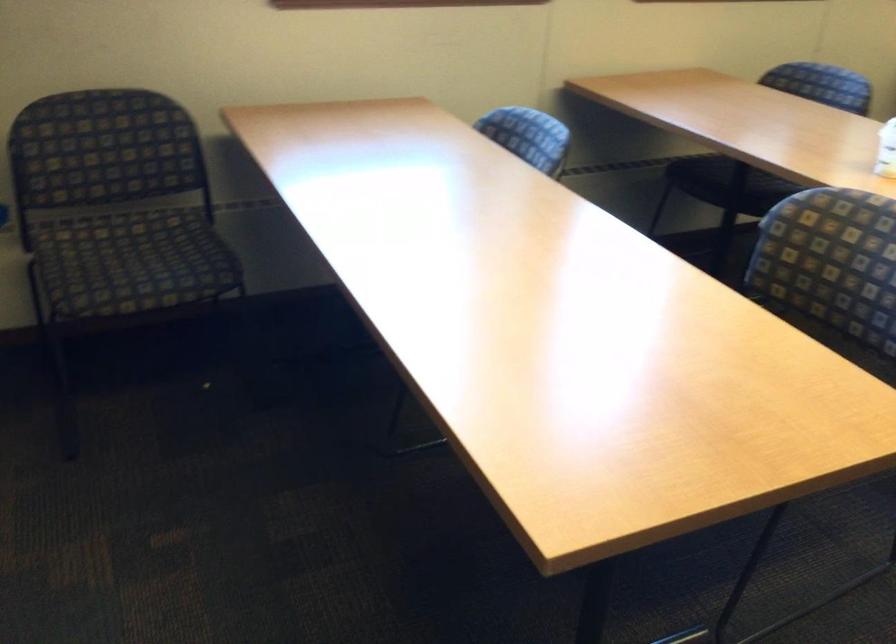
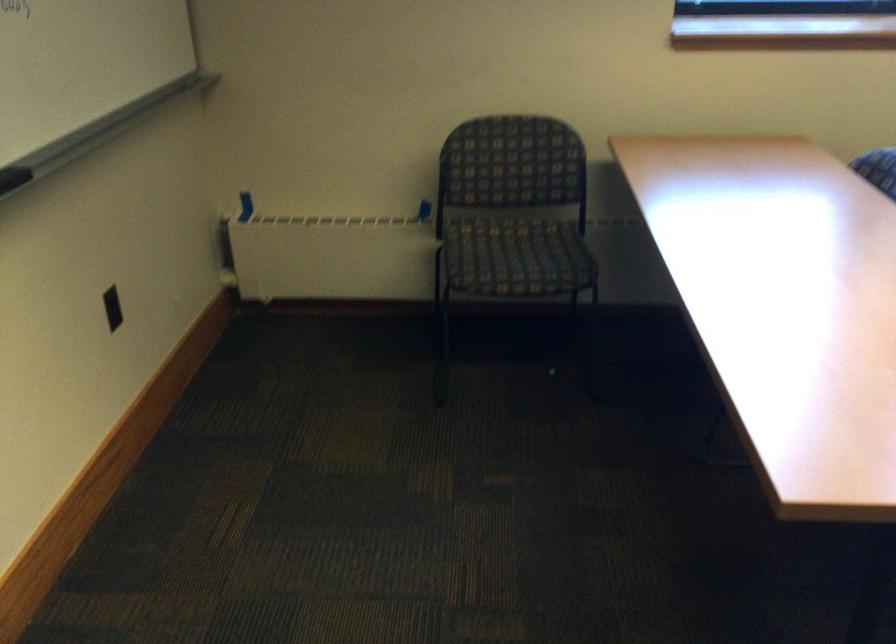
In the second image, find the point that corresponds to pixel 92 222 in the first image.

(488, 220)